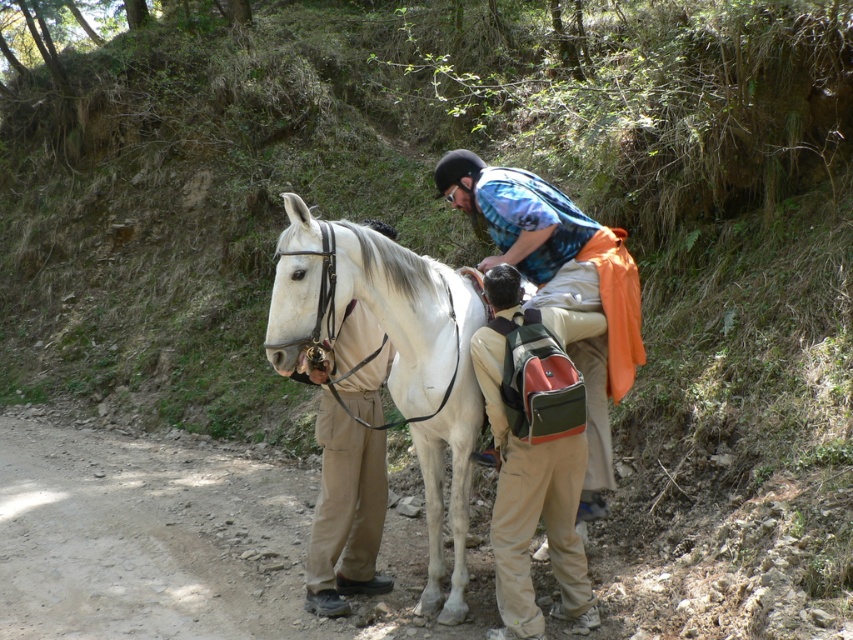
Who is more forward, (560, 387) or (372, 525)?

Point (560, 387) is more forward.

Between point (511, 602) and point (350, 362), which one is positioned in front?

Point (511, 602)

Where is `khaki cotton pants at center`? This screenshot has width=853, height=640. khaki cotton pants at center is located at coordinates (534, 449).

Who is positioned more to the left, white glossy horse at center or khaki cotton pants at center?

Positioned to the left is white glossy horse at center.

Is white glossy horse at center above khaki cotton pants at center?

Indeed, white glossy horse at center is positioned over khaki cotton pants at center.

Who is more distant from viewer, [451,320] or [578,582]?

Point [451,320]

The image size is (853, 640). I want to click on white glossy horse at center, so click(x=422, y=380).

Does white glossy horse at center have a smaller size compared to matte white pants at center?

No, white glossy horse at center is not smaller than matte white pants at center.

Is white glossy horse at center shorter than matte white pants at center?

No, white glossy horse at center is not shorter than matte white pants at center.

What do you see at coordinates (422, 380) in the screenshot?
I see `white glossy horse at center` at bounding box center [422, 380].

I want to click on white glossy horse at center, so click(422, 380).